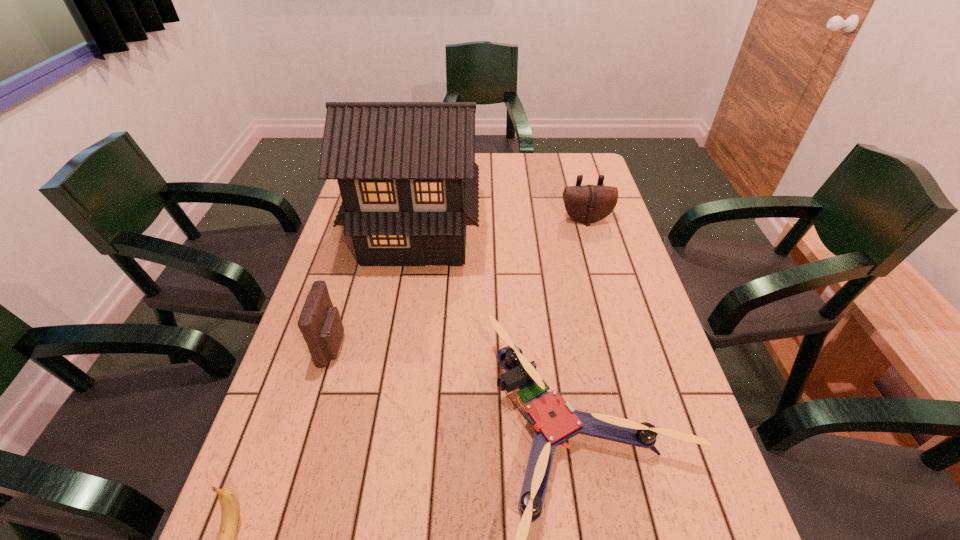
I want to click on the tallest object, so click(x=406, y=171).

This screenshot has width=960, height=540. Identify the location of the left pouch. (320, 323).

Locate an element on the screen. The width and height of the screenshot is (960, 540). the farther pouch is located at coordinates (590, 203).

Locate an element on the screen. The width and height of the screenshot is (960, 540). vacant space located 0.400m on the front-facing side of the dollhouse is located at coordinates (389, 403).

Where is `vacant region located with an open flap on the nearer pouch`? vacant region located with an open flap on the nearer pouch is located at coordinates (423, 347).

This screenshot has width=960, height=540. Identify the location of vacant space located 0.080m with the flap open on the farther pouch. (592, 244).

This screenshot has height=540, width=960. In order to click on dollhouse that is at the left edge in this screenshot , I will do `click(406, 171)`.

This screenshot has height=540, width=960. Identify the location of pouch that is at the left edge. (320, 323).

Where is `object present at the right edge`? The height and width of the screenshot is (540, 960). object present at the right edge is located at coordinates (590, 203).

The height and width of the screenshot is (540, 960). In the image, there is a desktop. In order to click on vacant region at the far edge in this screenshot , I will do `click(493, 154)`.